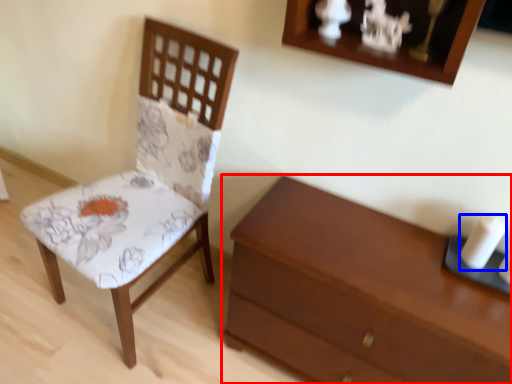
Question: Among these objects, which one is nearest to the camera, chest of drawers (highlighted by a red box) or candle (highlighted by a blue box)?

Choices:
 (A) chest of drawers
 (B) candle

Answer: (A)